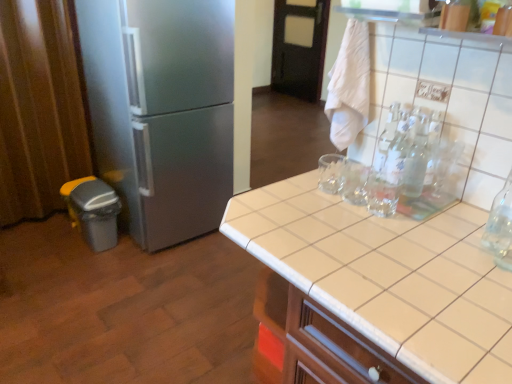
Question: From a real-world perspective, does satin silver refrigerator at left stand above clear glass bottle at upper right?

Choices:
 (A) no
 (B) yes

Answer: (A)

Question: Considering the relative positions of satin silver refrigerator at left and clear glass bottle at upper right in the image provided, is satin silver refrigerator at left behind clear glass bottle at upper right?

Choices:
 (A) no
 (B) yes

Answer: (B)

Question: Is satin silver refrigerator at left at the right side of clear glass bottle at upper right?

Choices:
 (A) no
 (B) yes

Answer: (A)

Question: Is satin silver refrigerator at left oriented towards clear glass bottle at upper right?

Choices:
 (A) yes
 (B) no

Answer: (A)

Question: Is satin silver refrigerator at left closer to the viewer compared to clear glass bottle at upper right?

Choices:
 (A) no
 (B) yes

Answer: (A)

Question: From the image's perspective, is satin silver refrigerator at left below clear glass bottle at upper right?

Choices:
 (A) yes
 (B) no

Answer: (B)

Question: From the image's perspective, would you say black wood door at upper center is shown under white tile countertop at center?

Choices:
 (A) no
 (B) yes

Answer: (A)

Question: Can you confirm if black wood door at upper center is positioned to the left of white tile countertop at center?

Choices:
 (A) no
 (B) yes

Answer: (A)

Question: Is black wood door at upper center at the right side of white tile countertop at center?

Choices:
 (A) yes
 (B) no

Answer: (A)

Question: Can you confirm if black wood door at upper center is wider than white tile countertop at center?

Choices:
 (A) no
 (B) yes

Answer: (A)

Question: Is black wood door at upper center taller than white tile countertop at center?

Choices:
 (A) yes
 (B) no

Answer: (A)

Question: Is black wood door at upper center oriented towards white tile countertop at center?

Choices:
 (A) yes
 (B) no

Answer: (B)

Question: Does black wood door at upper center touch brown fabric curtain at left?

Choices:
 (A) no
 (B) yes

Answer: (A)